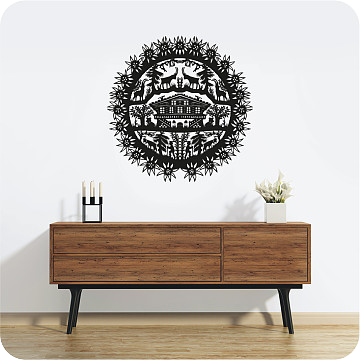
Identify the location of vase. This screenshot has width=360, height=360. (274, 208).